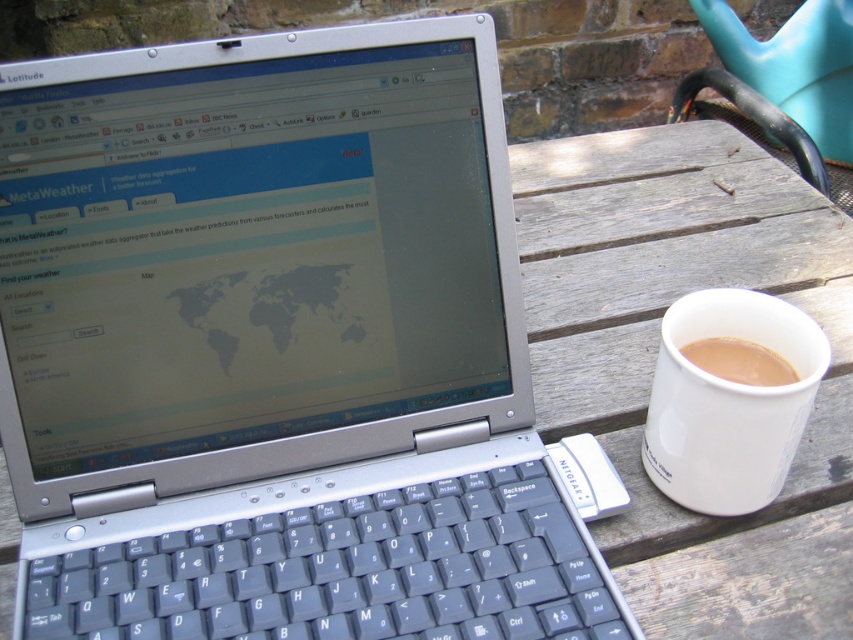
You are a barista who needs to place both the white ceramic mug at right and the white matte cup at right on a shelf that can only hold items spaced exactly 1.5 inches apart. Can you fit both items on the shelf without violating the spacing requirement?

The distance between the white ceramic mug at right and the white matte cup at right is 1.34 inches, which is less than the required 1.5 inches. Therefore, they cannot be placed on the shelf without violating the spacing requirement.

You are setting up a small workstation outdoors and have a silver metallic laptop at center and a white ceramic mug at right. If you want to place both items on a 12 inch wide shelf, will they fit side by side?

The silver metallic laptop at center is larger than the white ceramic mug at right. Since the shelf is 12 inches wide, it depends on the combined width of both items. However, without specific measurements, we cannot confirm if they will fit. Please measure both items to ensure they fit within the shelf width.

You are a photographer setting up equipment in the scene. You need to place a tripod between the silver metallic laptop at center and the white matte cup at right. Since the laptop is closer to you, will the tripod be placed closer to the laptop or the cup?

The tripod should be placed closer to the white matte cup at right because the silver metallic laptop at center is closer to the viewer, meaning the cup is farther away. To position the tripod between them, it needs to be nearer to the cup to maintain the spatial relationship.